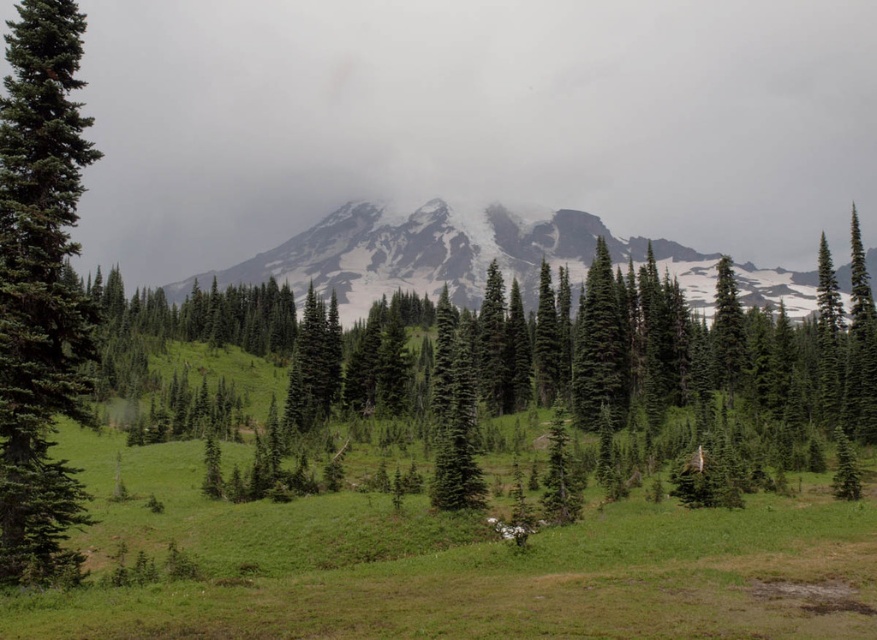
Question: Which object appears farthest from the camera in this image?

Choices:
 (A) green matte tree at left
 (B) snowy granite mountain at center

Answer: (B)

Question: Does green matte tree at center have a lesser width compared to snowy granite mountain at center?

Choices:
 (A) no
 (B) yes

Answer: (A)

Question: Does green matte tree at center lie behind snowy granite mountain at center?

Choices:
 (A) yes
 (B) no

Answer: (B)

Question: Which point is closer to the camera?

Choices:
 (A) (376, 260)
 (B) (39, 273)

Answer: (B)

Question: Based on their relative distances, which object is farther from the snowy granite mountain at center?

Choices:
 (A) green matte tree at center
 (B) green matte tree at left

Answer: (B)

Question: Can you confirm if green matte tree at left is positioned to the left of snowy granite mountain at center?

Choices:
 (A) no
 (B) yes

Answer: (B)